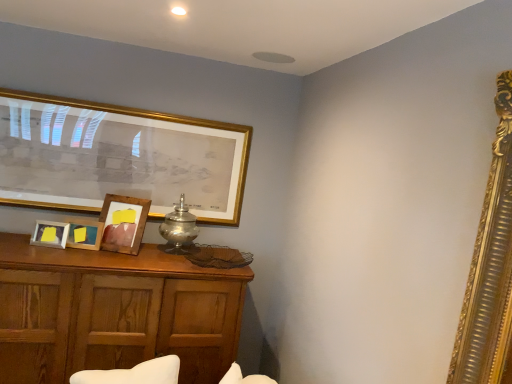
Where is `wooden picture frame at center, the third picture frame in the front-to-back sequence`? wooden picture frame at center, the third picture frame in the front-to-back sequence is located at coordinates (123, 223).

What do you see at coordinates (50, 234) in the screenshot? Image resolution: width=512 pixels, height=384 pixels. I see `wooden photo frame at lower left, which appears as the 1th picture frame when viewed from the front` at bounding box center [50, 234].

In order to click on gold-framed picture at upper left, the first picture frame from the back in this screenshot , I will do `click(119, 157)`.

Find the location of a particular element. wooden picture frame at center, which is the third picture frame in back-to-front order is located at coordinates (84, 234).

Which object is closer to the camera, wooden picture frame at center, the third picture frame in the front-to-back sequence, or gold-framed picture at upper left, the fourth picture frame viewed from the front?

Positioned in front is wooden picture frame at center, the third picture frame in the front-to-back sequence.

Is wooden picture frame at center, the third picture frame in the front-to-back sequence, oriented away from gold-framed picture at upper left, the fourth picture frame viewed from the front?

Correct, wooden picture frame at center, the third picture frame in the front-to-back sequence, is looking away from gold-framed picture at upper left, the fourth picture frame viewed from the front.

Is point (128, 210) closer or farther from the camera than point (47, 162)?

Clearly, point (128, 210) is closer to the camera than point (47, 162).

Is gold-framed picture at upper left, the fourth picture frame viewed from the front, turned away from wooden photo frame at lower left, which appears as the 1th picture frame when viewed from the front?

gold-framed picture at upper left, the fourth picture frame viewed from the front, does not have its back to wooden photo frame at lower left, which appears as the 1th picture frame when viewed from the front.

The height and width of the screenshot is (384, 512). In order to click on the 3rd picture frame below the gold-framed picture at upper left, the fourth picture frame viewed from the front (from the image's perspective) in this screenshot , I will do `click(50, 234)`.

Considering the relative positions of gold-framed picture at upper left, the first picture frame from the back, and wooden photo frame at lower left, which appears as the 1th picture frame when viewed from the front, in the image provided, is gold-framed picture at upper left, the first picture frame from the back, to the left or to the right of wooden photo frame at lower left, which appears as the 1th picture frame when viewed from the front,?

In the image, gold-framed picture at upper left, the first picture frame from the back, appears on the right side of wooden photo frame at lower left, which appears as the 1th picture frame when viewed from the front.

Does wooden photo frame at lower left, placed as the 4th picture frame when sorted from back to front, turn towards silver metallic table lamp at center?

No.

Consider the image. From the image's perspective, is wooden photo frame at lower left, which appears as the 1th picture frame when viewed from the front, located above or below silver metallic table lamp at center?

Clearly, from the image's perspective, wooden photo frame at lower left, which appears as the 1th picture frame when viewed from the front, is below silver metallic table lamp at center.

In the image, is wooden photo frame at lower left, placed as the 4th picture frame when sorted from back to front, on the left side or the right side of silver metallic table lamp at center?

Based on their positions, wooden photo frame at lower left, placed as the 4th picture frame when sorted from back to front, is located to the left of silver metallic table lamp at center.

Is wooden photo frame at lower left, placed as the 4th picture frame when sorted from back to front, positioned beyond the bounds of silver metallic table lamp at center?

Yes.

Between silver metallic table lamp at center and wooden cabinet at lower left, which one has larger size?

wooden cabinet at lower left is bigger.

Is silver metallic table lamp at center in front of wooden cabinet at lower left?

No, it is not.

From the image's perspective, who appears lower, silver metallic table lamp at center or wooden cabinet at lower left?

wooden cabinet at lower left, from the image's perspective.

Which is more to the left, silver metallic table lamp at center or wooden cabinet at lower left?

From the viewer's perspective, wooden cabinet at lower left appears more on the left side.

Considering the points (158, 279) and (53, 242), which point is in front, point (158, 279) or point (53, 242)?

The point (53, 242) is more forward.

Visually, is wooden cabinet at lower left positioned to the left or to the right of wooden photo frame at lower left, which appears as the 1th picture frame when viewed from the front?

Clearly, wooden cabinet at lower left is on the right of wooden photo frame at lower left, which appears as the 1th picture frame when viewed from the front, in the image.

Based on their sizes in the image, would you say wooden cabinet at lower left is bigger or smaller than wooden photo frame at lower left, which appears as the 1th picture frame when viewed from the front?

wooden cabinet at lower left is bigger than wooden photo frame at lower left, which appears as the 1th picture frame when viewed from the front.

Measure the distance from wooden cabinet at lower left to wooden photo frame at lower left, which appears as the 1th picture frame when viewed from the front.

A distance of 46.58 centimeters exists between wooden cabinet at lower left and wooden photo frame at lower left, which appears as the 1th picture frame when viewed from the front.

From a real-world perspective, is wooden picture frame at center, which is the third picture frame in back-to-front order, physically located above or below wooden picture frame at center, positioned as the second picture frame in back-to-front order?

In terms of real-world spatial position, wooden picture frame at center, which is the third picture frame in back-to-front order, is below wooden picture frame at center, positioned as the second picture frame in back-to-front order.

Does wooden picture frame at center, which is the third picture frame in back-to-front order, have a greater height compared to wooden picture frame at center, the third picture frame in the front-to-back sequence?

No.

Is there a large distance between wooden picture frame at center, the 2th picture frame viewed from the front, and wooden picture frame at center, the third picture frame in the front-to-back sequence?

No, wooden picture frame at center, the 2th picture frame viewed from the front, is not far from wooden picture frame at center, the third picture frame in the front-to-back sequence.

Does wooden picture frame at center, positioned as the second picture frame in back-to-front order, appear on the right side of wooden photo frame at lower left, placed as the 4th picture frame when sorted from back to front?

Indeed, wooden picture frame at center, positioned as the second picture frame in back-to-front order, is positioned on the right side of wooden photo frame at lower left, placed as the 4th picture frame when sorted from back to front.

From the image's perspective, which object appears higher, wooden picture frame at center, the third picture frame in the front-to-back sequence, or wooden photo frame at lower left, placed as the 4th picture frame when sorted from back to front?

wooden picture frame at center, the third picture frame in the front-to-back sequence, is shown above in the image.

Does wooden picture frame at center, the third picture frame in the front-to-back sequence, have a lesser width compared to wooden photo frame at lower left, which appears as the 1th picture frame when viewed from the front?

No.

Is wooden picture frame at center, the third picture frame in the front-to-back sequence, further to the viewer compared to wooden photo frame at lower left, placed as the 4th picture frame when sorted from back to front?

Yes, wooden picture frame at center, the third picture frame in the front-to-back sequence, is further from the viewer.

Locate an element on the screen. The image size is (512, 384). picture frame on the right of gold-framed picture at upper left, the fourth picture frame viewed from the front is located at coordinates (123, 223).

Find the location of a particular element. picture frame that is the 3rd one above the wooden photo frame at lower left, which appears as the 1th picture frame when viewed from the front (from a real-world perspective) is located at coordinates (119, 157).

Based on their spatial positions, is wooden cabinet at lower left or wooden picture frame at center, positioned as the second picture frame in back-to-front order, further from gold-framed picture at upper left, the fourth picture frame viewed from the front?

wooden cabinet at lower left is positioned further to the anchor gold-framed picture at upper left, the fourth picture frame viewed from the front.

When comparing their distances from wooden cabinet at lower left, does wooden picture frame at center, the third picture frame in the front-to-back sequence, or silver metallic table lamp at center seem further?

silver metallic table lamp at center lies further to wooden cabinet at lower left than the other object.

Estimate the real-world distances between objects in this image. Which object is closer to wooden cabinet at lower left, wooden photo frame at lower left, placed as the 4th picture frame when sorted from back to front, or silver metallic table lamp at center?

silver metallic table lamp at center is closer to wooden cabinet at lower left.

Which object lies further to the anchor point gold-framed picture at upper left, the first picture frame from the back, silver metallic table lamp at center or wooden cabinet at lower left?

Based on the image, wooden cabinet at lower left appears to be further to gold-framed picture at upper left, the first picture frame from the back.

Looking at the image, which one is located closer to gold-framed picture at upper left, the fourth picture frame viewed from the front, wooden picture frame at center, the 2th picture frame viewed from the front, or wooden cabinet at lower left?

wooden picture frame at center, the 2th picture frame viewed from the front, is closer to gold-framed picture at upper left, the fourth picture frame viewed from the front.

Based on their spatial positions, is wooden cabinet at lower left or wooden photo frame at lower left, placed as the 4th picture frame when sorted from back to front, closer to wooden picture frame at center, which is the third picture frame in back-to-front order?

Among the two, wooden photo frame at lower left, placed as the 4th picture frame when sorted from back to front, is located nearer to wooden picture frame at center, which is the third picture frame in back-to-front order.

Based on their spatial positions, is wooden picture frame at center, which is the third picture frame in back-to-front order, or wooden picture frame at center, positioned as the second picture frame in back-to-front order, closer to silver metallic table lamp at center?

wooden picture frame at center, positioned as the second picture frame in back-to-front order, is positioned closer to the anchor silver metallic table lamp at center.

Estimate the real-world distances between objects in this image. Which object is closer to gold-framed picture at upper left, the first picture frame from the back, wooden picture frame at center, which is the third picture frame in back-to-front order, or wooden photo frame at lower left, which appears as the 1th picture frame when viewed from the front?

wooden picture frame at center, which is the third picture frame in back-to-front order, is positioned closer to the anchor gold-framed picture at upper left, the first picture frame from the back.

Locate an element on the screen. Image resolution: width=512 pixels, height=384 pixels. picture frame that lies between wooden picture frame at center, which is the third picture frame in back-to-front order, and wooden cabinet at lower left from top to bottom is located at coordinates (50, 234).

You are a GUI agent. You are given a task and a screenshot of the screen. Output one action in this format:
    pyautogui.click(x=<x>, y=<y>)
    Task: Click on the table lamp between gold-framed picture at upper left, the fourth picture frame viewed from the front, and wooden cabinet at lower left in the up-down direction
    This screenshot has height=384, width=512.
    Given the screenshot: What is the action you would take?
    pos(179,228)

Find the location of a particular element. The image size is (512, 384). table lamp that lies between gold-framed picture at upper left, the first picture frame from the back, and wooden picture frame at center, positioned as the second picture frame in back-to-front order, from top to bottom is located at coordinates pyautogui.click(x=179, y=228).

Find the location of a particular element. This screenshot has height=384, width=512. picture frame between gold-framed picture at upper left, the fourth picture frame viewed from the front, and wooden picture frame at center, the 2th picture frame viewed from the front, vertically is located at coordinates (123, 223).